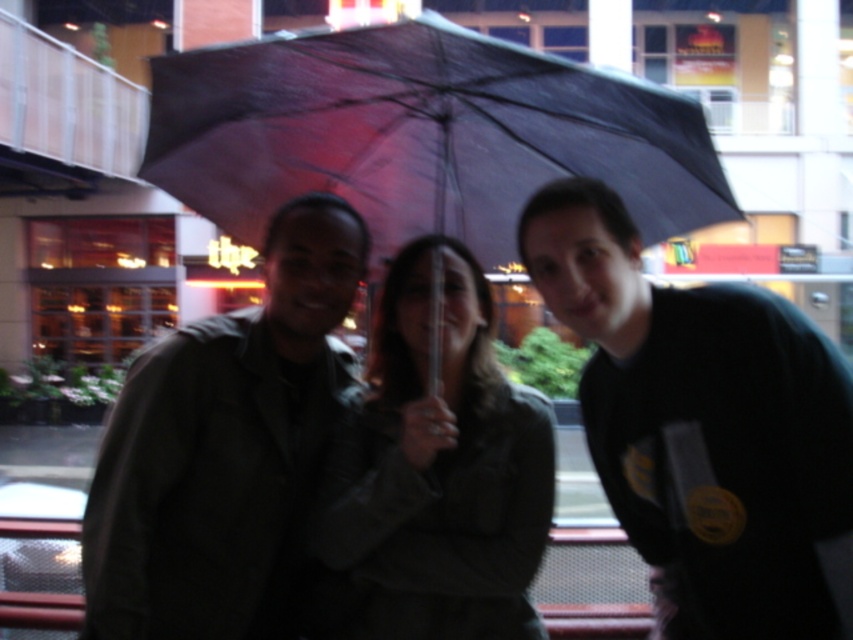
You are a photographer trying to capture a clear shot of the black matte shirt at right without the matte black umbrella at center blocking it. Based on the scene, is this possible?

The black matte shirt at right is behind the matte black umbrella at center, so the umbrella would block the view of the shirt. To capture a clear shot, you would need to adjust your angle or position to move around the umbrella.

You are trying to decide whether to carry the matte black umbrella at center or the matte black jacket at center while walking in the rain. Based on their sizes, which one would be more practical to use as a shield from the rain?

The matte black umbrella at center has a larger width than the matte black jacket at center, making it more practical to use as a shield from the rain.

You are a photographer trying to capture a group photo of the three people under the matte black umbrella at center and the black matte shirt at right. Since you want to ensure the entire group fits in the frame, which object should you focus on to determine the required frame width?

The matte black umbrella at center has a greater width than the black matte shirt at right, so focusing on the matte black umbrella at center will ensure the entire group fits within the frame.